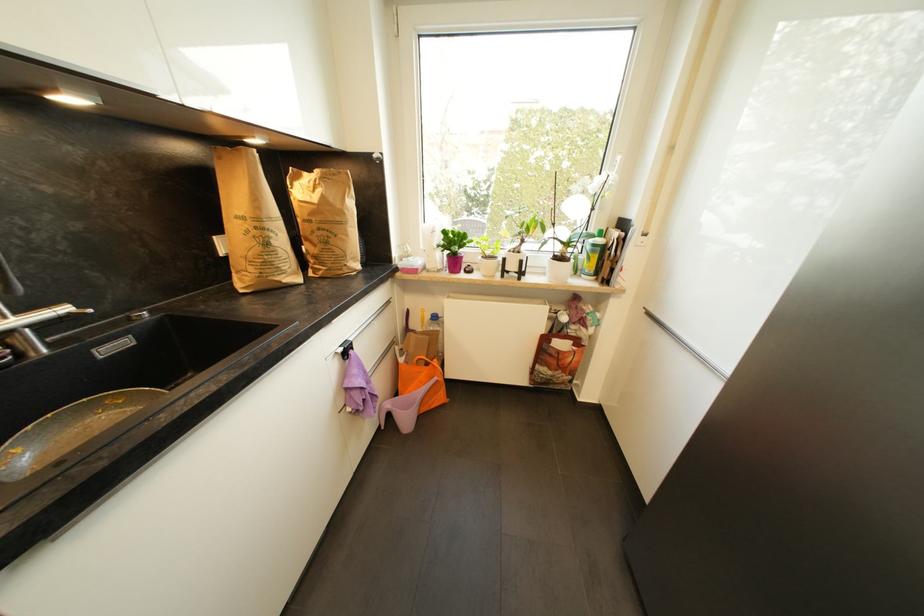
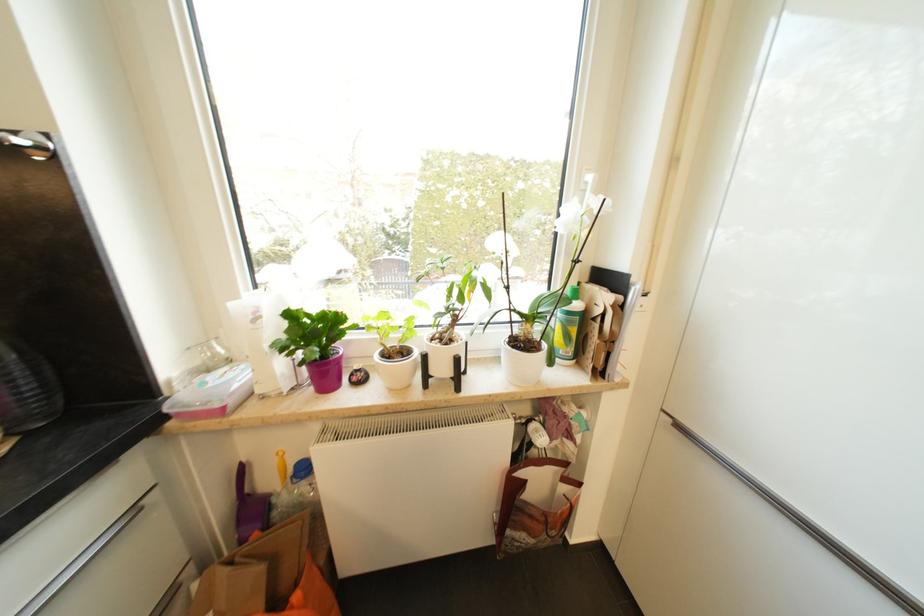
Find the pixel in the second image that matches (517,268) in the first image.

(446, 371)